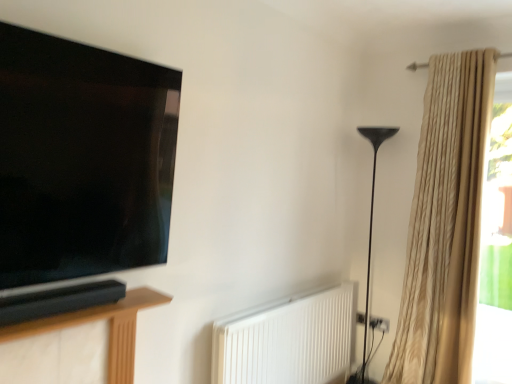
The image size is (512, 384). Describe the element at coordinates (445, 224) in the screenshot. I see `beige textured curtain at right` at that location.

In order to face matte black tv at left, should I rotate leftwards or rightwards?

Turn left approximately 19.172 degrees to face it.

At what (x,y) coordinates should I click in order to perform the action: click on beige textured curtain at right. Please return your answer as a coordinate pair (x, y). Looking at the image, I should click on (445, 224).

Based on the photo, is translucent glass window at right at the back of beige textured curtain at right?

No.

From a real-world perspective, is beige textured curtain at right located higher than translucent glass window at right?

Yes, from a real-world perspective, beige textured curtain at right is on top of translucent glass window at right.

Is beige textured curtain at right bigger or smaller than translucent glass window at right?

In the image, beige textured curtain at right appears to be larger than translucent glass window at right.

In terms of width, does beige textured curtain at right look wider or thinner when compared to translucent glass window at right?

Clearly, beige textured curtain at right has more width compared to translucent glass window at right.

Consider the image. Between brown wood soundbar at lower left and black metal floor lamp at right, which one appears on the left side from the viewer's perspective?

brown wood soundbar at lower left is more to the left.

Consider the image. Which of these two, brown wood soundbar at lower left or black metal floor lamp at right, is bigger?

With larger size is black metal floor lamp at right.

Which is less distant, [110,339] or [381,131]?

Point [110,339] is closer to the camera than point [381,131].

Which of these two, brown wood soundbar at lower left or black metal floor lamp at right, stands taller?

With more height is black metal floor lamp at right.

Is black metal floor lamp at right oriented away from brown wood soundbar at lower left?

That's not correct — black metal floor lamp at right is not looking away from brown wood soundbar at lower left.

In the scene shown: Can you confirm if black metal floor lamp at right is shorter than brown wood soundbar at lower left?

No, black metal floor lamp at right is not shorter than brown wood soundbar at lower left.

You are a GUI agent. You are given a task and a screenshot of the screen. Output one action in this format:
    pyautogui.click(x=<x>, y=<y>)
    Task: Click on the furniture located above the black metal floor lamp at right (from the image's perspective)
    This screenshot has width=512, height=384.
    Given the screenshot: What is the action you would take?
    pyautogui.click(x=109, y=329)

Considering the points (366, 310) and (110, 324), which point is behind, point (366, 310) or point (110, 324)?

Point (366, 310)

Considering the sizes of objects white matte radiator at lower center and brown wood soundbar at lower left in the image provided, who is wider, white matte radiator at lower center or brown wood soundbar at lower left?

brown wood soundbar at lower left.

From a real-world perspective, which is physically above, white matte radiator at lower center or brown wood soundbar at lower left?

brown wood soundbar at lower left, from a real-world perspective.

Which point is more forward, (275, 375) or (126, 375)?

The point (126, 375) is closer.

Based on the photo, is matte black tv at left to the right of black metal floor lamp at right from the viewer's perspective?

Incorrect, matte black tv at left is not on the right side of black metal floor lamp at right.

Is black metal floor lamp at right completely or partially inside matte black tv at left?

No, black metal floor lamp at right is not a part of matte black tv at left.

Could you tell me if matte black tv at left is facing black metal floor lamp at right?

No, matte black tv at left is not turned towards black metal floor lamp at right.

Is matte black tv at left wider than black metal floor lamp at right?

In fact, matte black tv at left might be narrower than black metal floor lamp at right.

Is matte black tv at left positioned with its back to white matte radiator at lower center?

No, matte black tv at left's orientation is not away from white matte radiator at lower center.

From a real-world perspective, which object rests below the other?

From a 3D spatial view, white matte radiator at lower center is below.

From the picture: From the image's perspective, is matte black tv at left above white matte radiator at lower center?

Indeed, from the image's perspective, matte black tv at left is shown above white matte radiator at lower center.

Could white matte radiator at lower center be considered to be inside matte black tv at left?

No, matte black tv at left does not contain white matte radiator at lower center.

At what (x,y) coordinates should I click in order to perform the action: click on table lamp located below the translucent glass window at right (from the image's perspective). Please return your answer as a coordinate pair (x, y). The height and width of the screenshot is (384, 512). Looking at the image, I should click on pyautogui.click(x=372, y=216).

Which object is positioned more to the left, black metal floor lamp at right or translucent glass window at right?

Positioned to the left is black metal floor lamp at right.

From a real-world perspective, who is located lower, black metal floor lamp at right or translucent glass window at right?

black metal floor lamp at right is physically lower.

Is black metal floor lamp at right aimed at translucent glass window at right?

No, black metal floor lamp at right is not facing towards translucent glass window at right.

Where is `curtain above the translucent glass window at right (from the image's perspective)`? The height and width of the screenshot is (384, 512). curtain above the translucent glass window at right (from the image's perspective) is located at coordinates (445, 224).

This screenshot has width=512, height=384. What are the coordinates of `table lamp beneath the brown wood soundbar at lower left (from a real-world perspective)` in the screenshot? It's located at (372, 216).

From the picture: Considering their positions, is brown wood soundbar at lower left positioned further to matte black tv at left than translucent glass window at right?

translucent glass window at right lies further to matte black tv at left than the other object.

When comparing their distances from white matte radiator at lower center, does beige textured curtain at right or translucent glass window at right seem closer?

Based on the image, beige textured curtain at right appears to be nearer to white matte radiator at lower center.

Looking at the image, which one is located further to black metal floor lamp at right, brown wood soundbar at lower left or beige textured curtain at right?

brown wood soundbar at lower left lies further to black metal floor lamp at right than the other object.

Estimate the real-world distances between objects in this image. Which object is closer to matte black tv at left, beige textured curtain at right or black metal floor lamp at right?

beige textured curtain at right lies closer to matte black tv at left than the other object.

Estimate the real-world distances between objects in this image. Which object is closer to black metal floor lamp at right, brown wood soundbar at lower left or matte black tv at left?

brown wood soundbar at lower left is closer to black metal floor lamp at right.

Which object lies nearer to the anchor point black metal floor lamp at right, white matte radiator at lower center or beige textured curtain at right?

The object closer to black metal floor lamp at right is beige textured curtain at right.

Estimate the real-world distances between objects in this image. Which object is closer to black metal floor lamp at right, matte black tv at left or beige textured curtain at right?

beige textured curtain at right is closer to black metal floor lamp at right.

Which object lies further to the anchor point black metal floor lamp at right, translucent glass window at right or matte black tv at left?

matte black tv at left.

This screenshot has height=384, width=512. In order to click on table lamp situated between matte black tv at left and translucent glass window at right from left to right in this screenshot , I will do `click(372, 216)`.

You are a GUI agent. You are given a task and a screenshot of the screen. Output one action in this format:
    pyautogui.click(x=<x>, y=<y>)
    Task: Click on the television between brown wood soundbar at lower left and beige textured curtain at right in the horizontal direction
    The image size is (512, 384).
    Given the screenshot: What is the action you would take?
    pyautogui.click(x=80, y=171)

The image size is (512, 384). Identify the location of radiator between matte black tv at left and black metal floor lamp at right from front to back. (288, 339).

Identify the location of curtain situated between white matte radiator at lower center and translucent glass window at right from left to right. This screenshot has height=384, width=512. (445, 224).